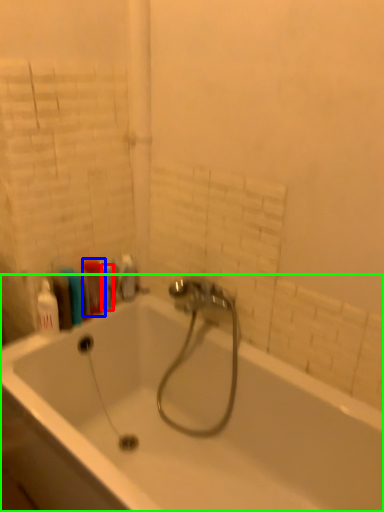
Question: Estimate the real-world distances between objects in this image. Which object is farther from toiletry (highlighted by a red box), cleaning product (highlighted by a blue box) or bathtub (highlighted by a green box)?

Choices:
 (A) cleaning product
 (B) bathtub

Answer: (B)